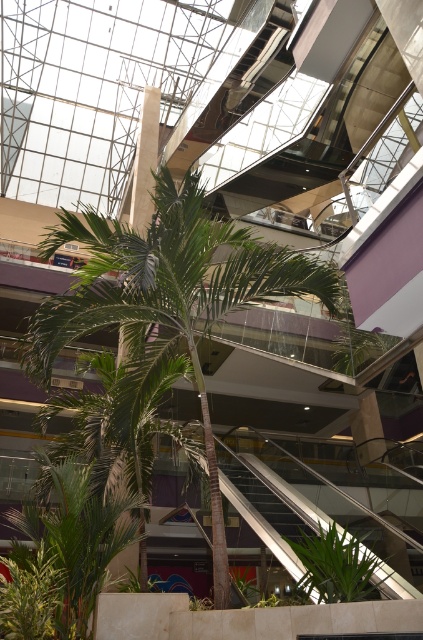
You are at the shopping mall and want to take a photo of the metallic silver escalator at lower center and the green leafy plant at center. Which object should you focus on first if you want to capture both in a single frame without moving the camera?

The metallic silver escalator at lower center is not as tall as the green leafy plant at center, so you should focus on the metallic silver escalator at lower center first to ensure both are in the frame.

You are a delivery person carrying a large box that is 2 meters wide. You need to move it through the space between the metallic silver escalator at lower center and the green leafy plant at center. Can the box fit through that space?

The metallic silver escalator at lower center is wider than the green leafy plant at center. Therefore, the space between them may be too narrow for a 2 meter wide box. The box might not fit through the space between the metallic silver escalator at lower center and the green leafy plant at center.